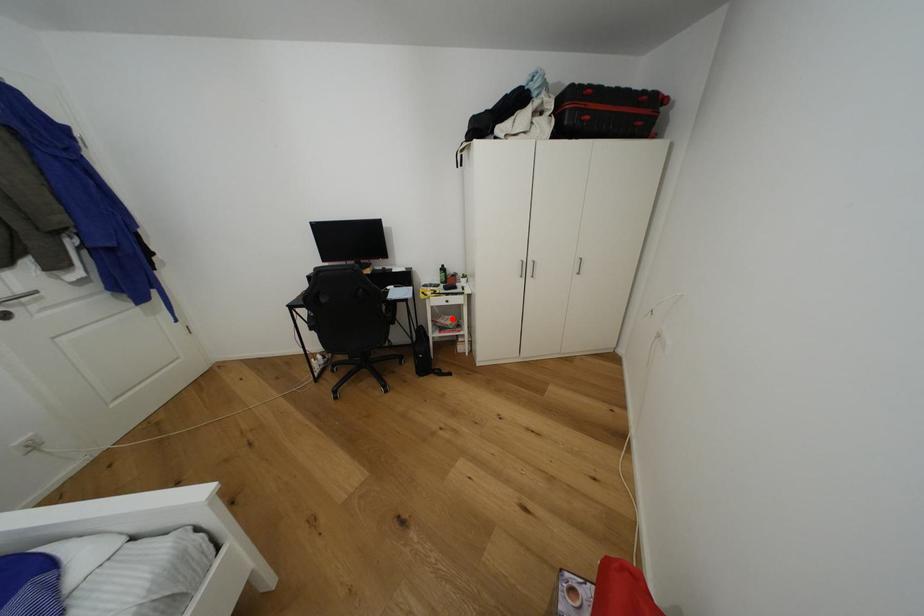
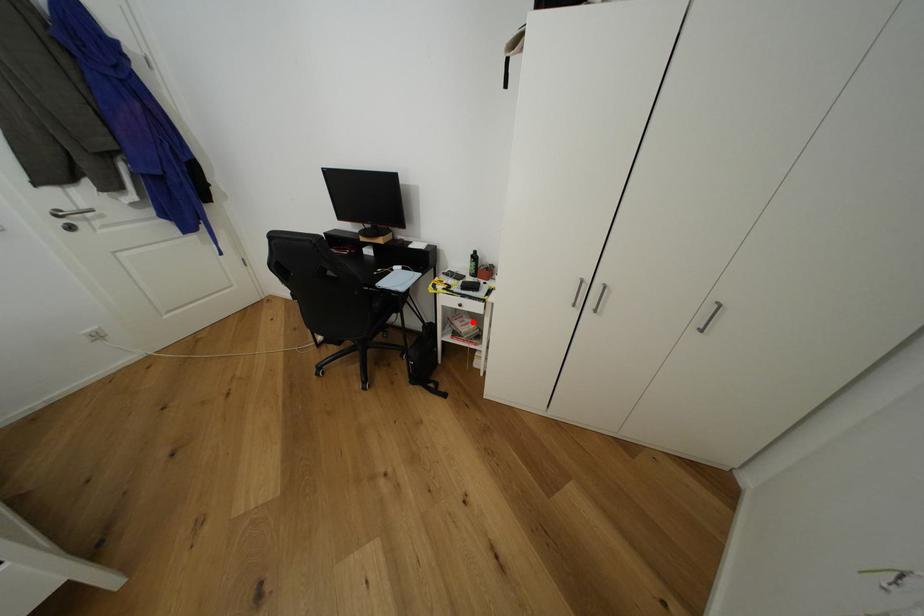
I am providing you with two images of the same scene from different viewpoints. A red point is marked on the first image and another point is marked on the second image. Do the highlighted points in image1 and image2 indicate the same real-world spot?

Yes